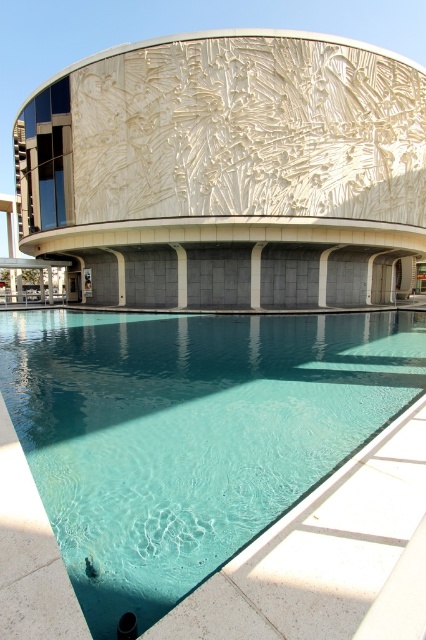
You are a visitor standing in front of the modern architectural structure. You see the clear glass pool at lower center and the white textured wall at center. Which object is shorter in height?

The clear glass pool at lower center is not as tall as the white textured wall at center, so the clear glass pool at lower center is shorter in height.

Looking at this image, what are the coordinates of the clear glass pool at lower center in the image?

The clear glass pool at lower center is located at coordinates point (201, 467).